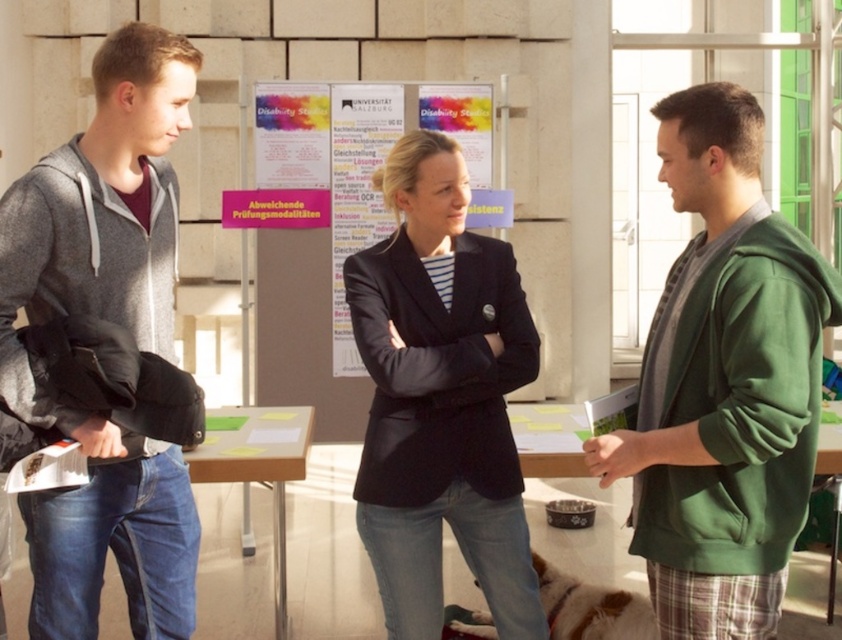
Question: Can you confirm if matte gray hoodie at left is smaller than matte white poster at center?

Choices:
 (A) no
 (B) yes

Answer: (A)

Question: Considering the real-world distances, which object is closest to the green fleece jacket at right?

Choices:
 (A) matte gray hoodie at left
 (B) matte white poster at center

Answer: (A)

Question: Is matte gray hoodie at left to the left of matte white poster at center from the viewer's perspective?

Choices:
 (A) no
 (B) yes

Answer: (B)

Question: Which object is farther from the camera taking this photo?

Choices:
 (A) matte white poster at center
 (B) dark blue blazer at center
 (C) white paper poster at center

Answer: (A)

Question: Does green fleece jacket at right appear under dark blue blazer at center?

Choices:
 (A) yes
 (B) no

Answer: (B)

Question: Which object is farther from the camera taking this photo?

Choices:
 (A) matte white poster at center
 (B) green fleece jacket at right

Answer: (A)